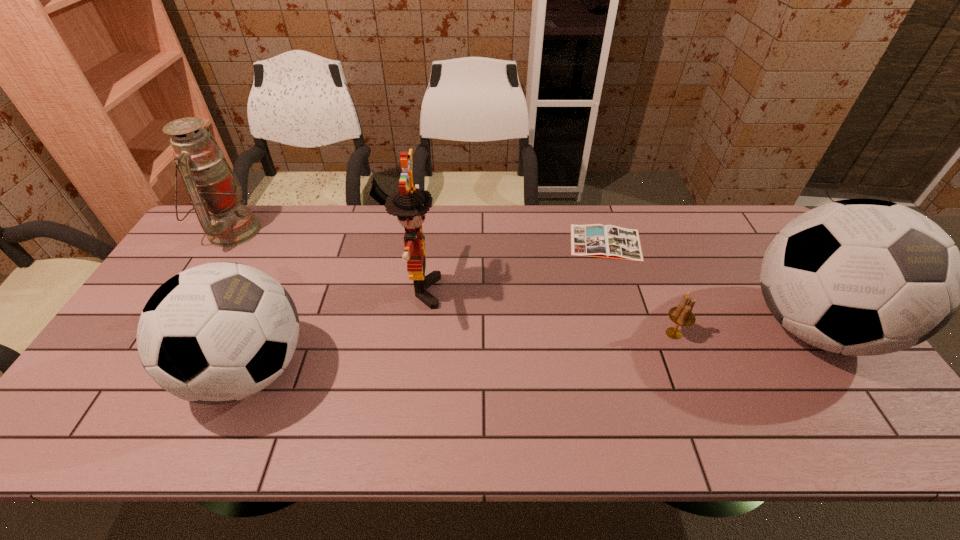
This screenshot has height=540, width=960. In order to click on vacant region at the near edge of the desktop in this screenshot , I will do click(x=525, y=389).

Find the location of a particular element. The width and height of the screenshot is (960, 540). vacant space at the left edge is located at coordinates (137, 349).

In the image, there is a desktop. At what (x,y) coordinates should I click in order to perform the action: click on vacant space at the right edge. Please return your answer as a coordinate pair (x, y). This screenshot has height=540, width=960. Looking at the image, I should click on (825, 359).

Where is `free spot at the near left corner of the desktop`? This screenshot has height=540, width=960. free spot at the near left corner of the desktop is located at coordinates (99, 403).

In the image, there is a desktop. Identify the location of vacant space at the far right corner. pyautogui.click(x=738, y=238).

Locate an element on the screen. This screenshot has height=540, width=960. free space between the rightmost object and the third object from left to right is located at coordinates (616, 309).

You are a GUI agent. You are given a task and a screenshot of the screen. Output one action in this format:
    pyautogui.click(x=<x>, y=<y>)
    Task: Click on the free point between the candle holder and the fourth object from right to left
    
    Given the screenshot: What is the action you would take?
    pyautogui.click(x=547, y=312)

The image size is (960, 540). Find the location of `free point between the nutcracker and the shortest object`. free point between the nutcracker and the shortest object is located at coordinates (514, 267).

Identify the location of vacant space that is in between the rightmost object and the leftmost object. The image size is (960, 540). (522, 279).

The height and width of the screenshot is (540, 960). What are the coordinates of `free space that is in between the oil lamp and the right soccer ball` in the screenshot? It's located at (522, 279).